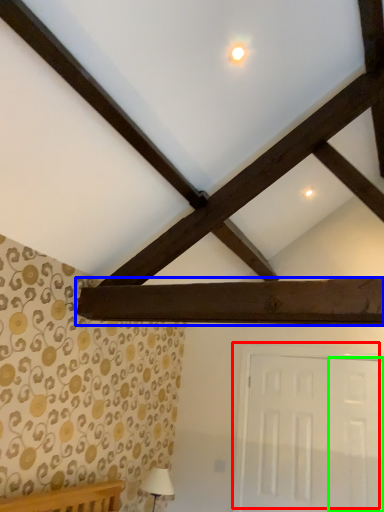
Question: Considering the real-world distances, which object is farthest from door (highlighted by a red box)? plank (highlighted by a blue box) or door (highlighted by a green box)?

Choices:
 (A) plank
 (B) door

Answer: (A)